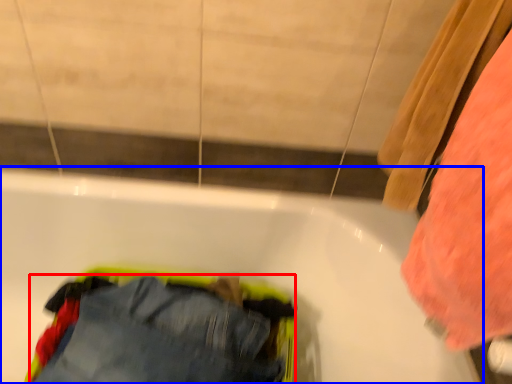
Question: Which of the following is the closest to the observer, trousers (highlighted by a red box) or bathtub (highlighted by a blue box)?

Choices:
 (A) trousers
 (B) bathtub

Answer: (B)